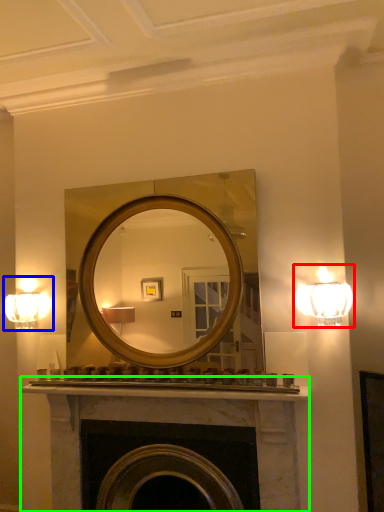
Question: Estimate the real-world distances between objects in this image. Which object is farther from lamp (highlighted by a red box), fixture (highlighted by a blue box) or fireplace (highlighted by a green box)?

Choices:
 (A) fixture
 (B) fireplace

Answer: (A)